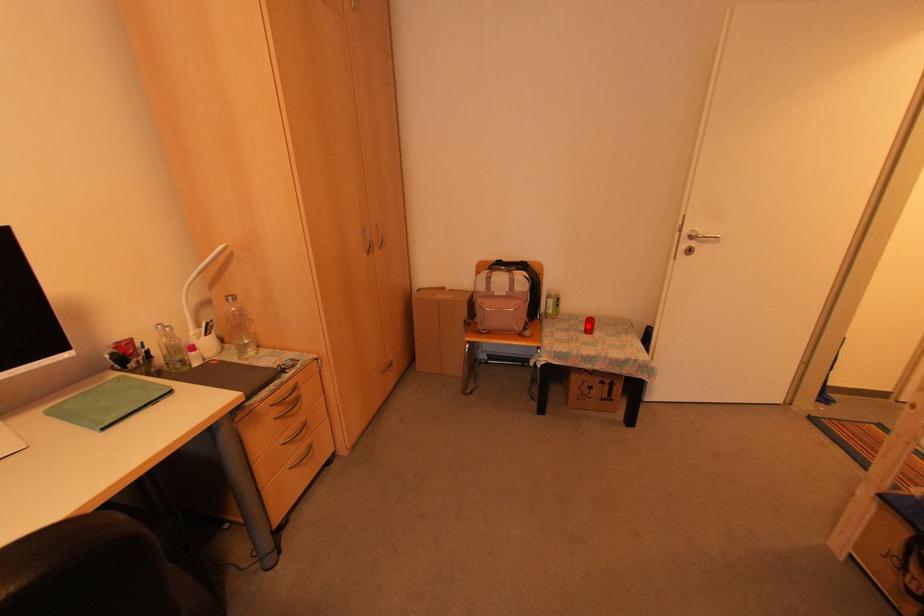
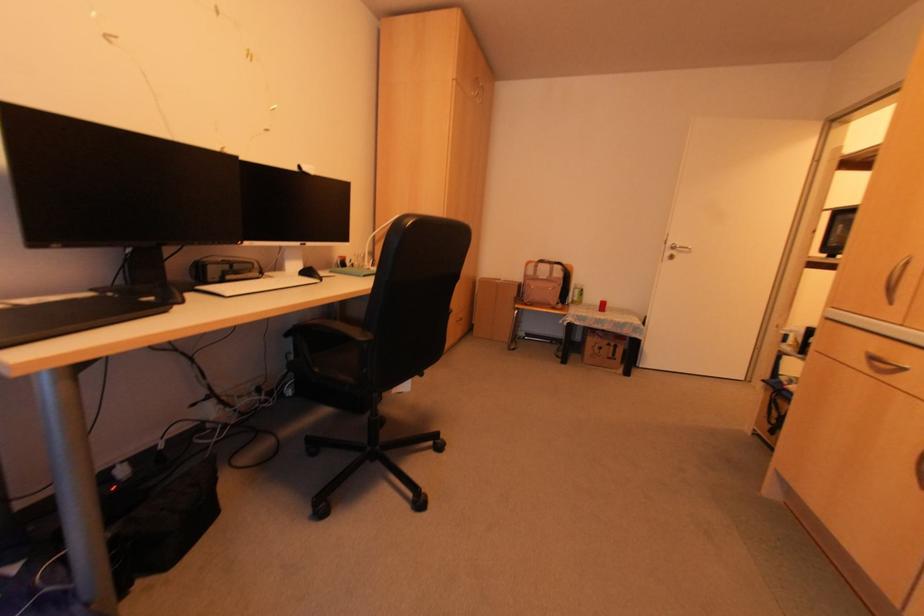
In the second image, find the point that corresponds to the highlighted location in the first image.

(601, 307)